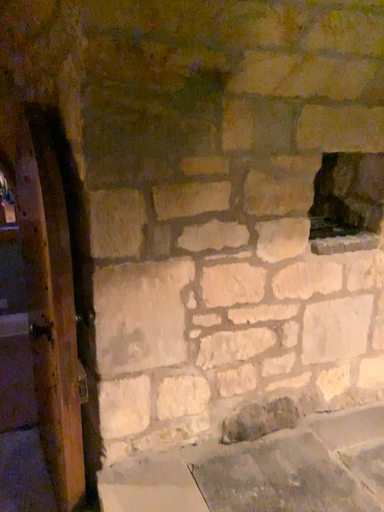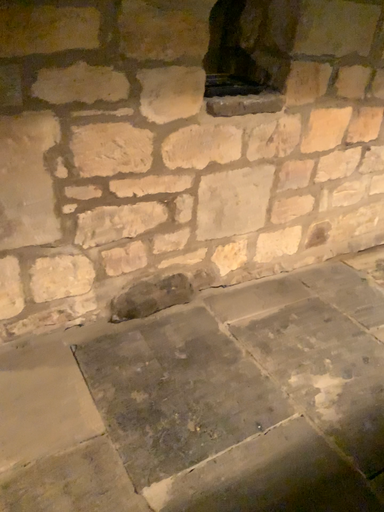
Question: How did the camera likely rotate when shooting the video?

Choices:
 (A) rotated left
 (B) rotated right

Answer: (B)